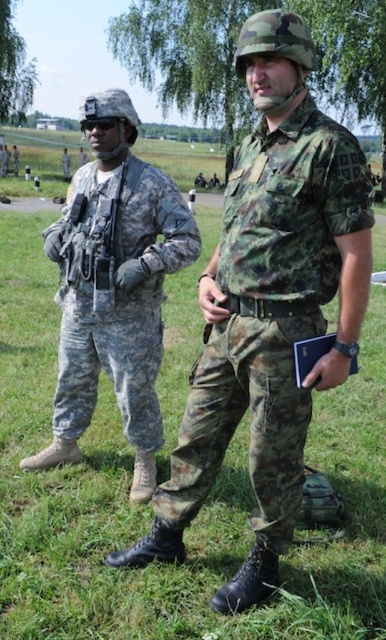
You are a drone operator trying to determine which point is closer to your camera. You see two points in the image labeled as point (x=262, y=138) and point (x=94, y=278). Which point is closer to your camera?

Point (x=262, y=138) is closer to the camera than point (x=94, y=278).

You are a photographer positioned behind both the camouflage fabric shirt at center and the matte black rifle at left. Which object would appear larger in your camera view?

The camouflage fabric shirt at center appears larger in the camera view because it is closer to the viewer than the matte black rifle at left.

You are a photographer trying to capture a clear shot of the camouflage fabric shirt at center and the camouflage fabric pants at left. Since both are in the same frame, which one do you need to focus on first to ensure it appears sharp in the photo?

The camouflage fabric shirt at center is in front of the camouflage fabric pants at left, so you should focus on the camouflage fabric shirt at center first to ensure it appears sharp.